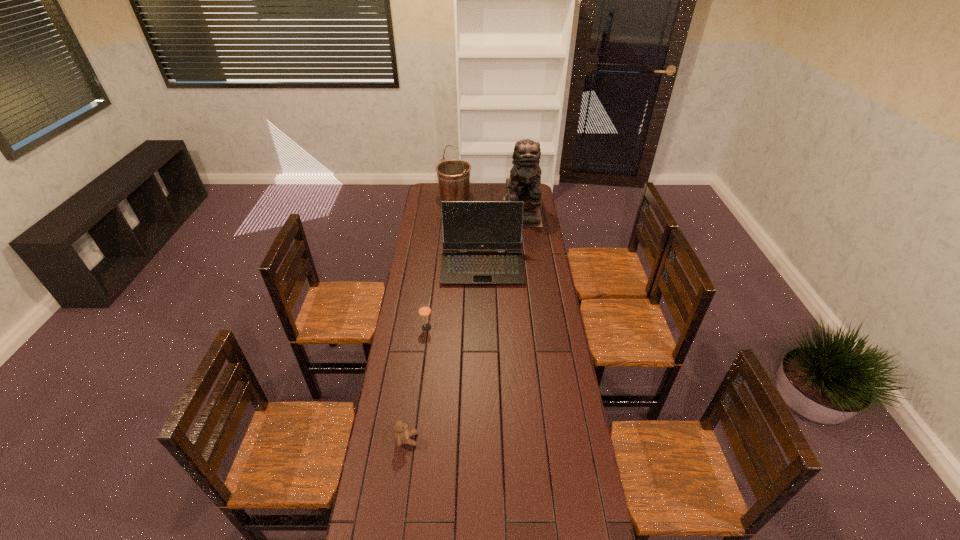
I want to click on object at the far left corner, so click(453, 176).

At what (x,y) coordinates should I click in order to perform the action: click on object positioned at the far right corner. Please return your answer as a coordinate pair (x, y). The height and width of the screenshot is (540, 960). Looking at the image, I should click on (524, 182).

Locate an element on the screen. The width and height of the screenshot is (960, 540). vacant space at the far edge of the desktop is located at coordinates (473, 186).

Locate an element on the screen. The height and width of the screenshot is (540, 960). blank area at the left edge is located at coordinates (426, 354).

Identify the location of vacant space at the right edge of the desktop. (525, 285).

You are a GUI agent. You are given a task and a screenshot of the screen. Output one action in this format:
    pyautogui.click(x=<x>, y=<y>)
    Task: Click on the vacant space that's between the straw and the teddy bear
    The width and height of the screenshot is (960, 540).
    Given the screenshot: What is the action you would take?
    pyautogui.click(x=417, y=383)

Find the location of `free space that is in between the fourth shortest object and the second nearest object`. free space that is in between the fourth shortest object and the second nearest object is located at coordinates click(441, 262).

Find the location of a particular element. The width and height of the screenshot is (960, 540). empty location between the second nearest object and the laptop computer is located at coordinates pyautogui.click(x=454, y=296).

I want to click on vacant region between the third nearest object and the shortest object, so click(x=444, y=353).

You are a GUI agent. You are given a task and a screenshot of the screen. Output one action in this format:
    pyautogui.click(x=<x>, y=<y>)
    Task: Click on the free space between the bucket and the shortest object
    The height and width of the screenshot is (540, 960).
    Given the screenshot: What is the action you would take?
    pyautogui.click(x=431, y=319)